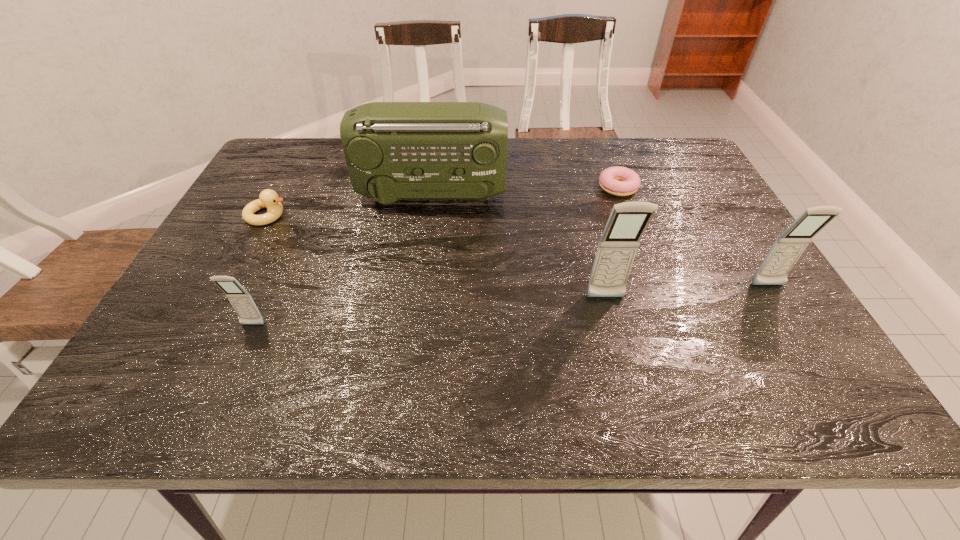
At what (x,y) coordinates should I click in order to perform the action: click on free space for an extra cellular_telephone to achieve even spacing. Please return your answer as a coordinate pair (x, y). Looking at the image, I should click on (434, 312).